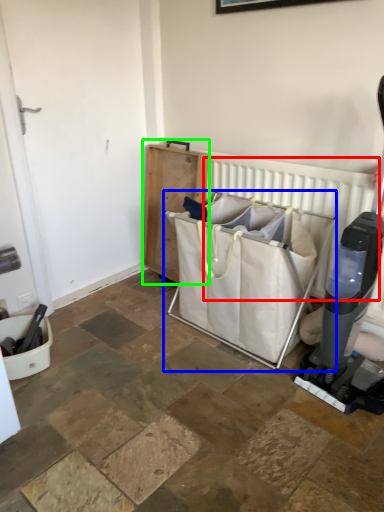
Question: Based on their relative distances, which object is farther from radiator (highlighted by a red box)? Choose from baby carriage (highlighted by a blue box) and furniture (highlighted by a green box).

Choices:
 (A) baby carriage
 (B) furniture

Answer: (B)